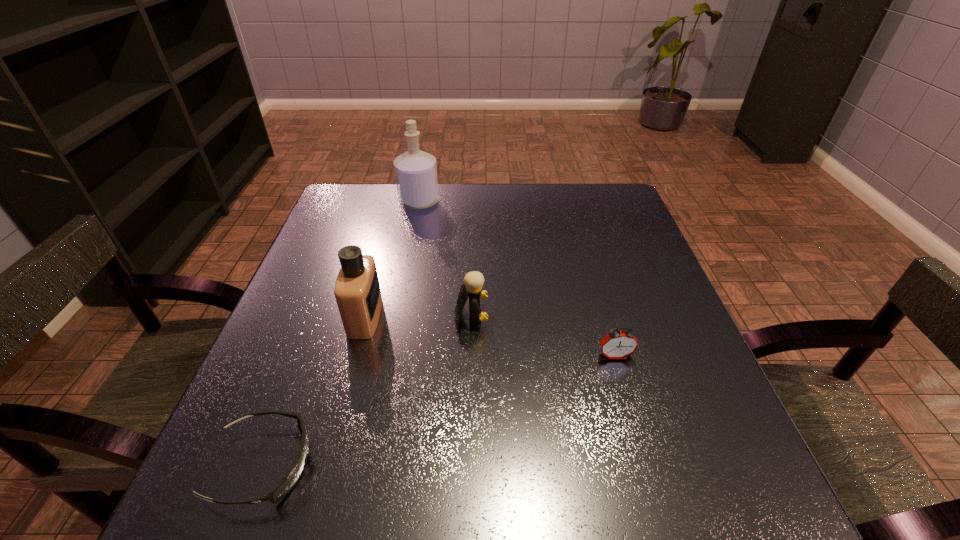
I want to click on the farthest object, so click(x=415, y=171).

Where is `the taller perfume`? Image resolution: width=960 pixels, height=540 pixels. the taller perfume is located at coordinates (415, 171).

The width and height of the screenshot is (960, 540). Find the location of `the shorter perfume`. the shorter perfume is located at coordinates (357, 291).

At what (x,y) coordinates should I click in order to perform the action: click on the nearer perfume. Please return your answer as a coordinate pair (x, y). This screenshot has width=960, height=540. Looking at the image, I should click on pos(357,291).

Where is `the third shortest object`? This screenshot has height=540, width=960. the third shortest object is located at coordinates 473,281.

This screenshot has height=540, width=960. I want to click on Lego, so click(473, 281).

Identify the location of alarm clock. Image resolution: width=960 pixels, height=540 pixels. (617, 344).

Where is `the rightmost object`? the rightmost object is located at coordinates (617, 344).

The height and width of the screenshot is (540, 960). I want to click on goggles, so click(x=293, y=475).

You are a GUI agent. You are given a task and a screenshot of the screen. Output one action in this format:
    pyautogui.click(x=<x>, y=<y>)
    Task: Click on the shortest object
    
    Given the screenshot: What is the action you would take?
    pyautogui.click(x=293, y=475)